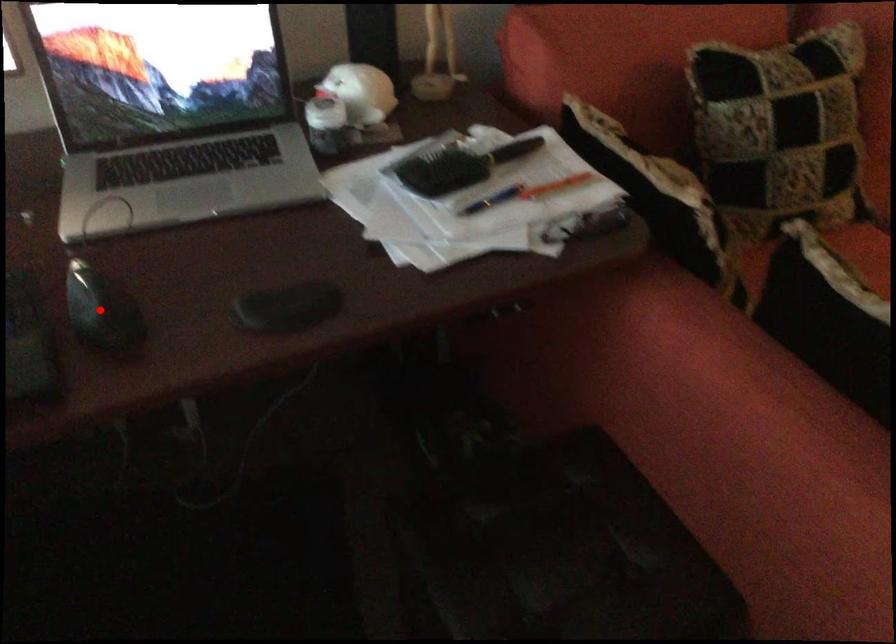
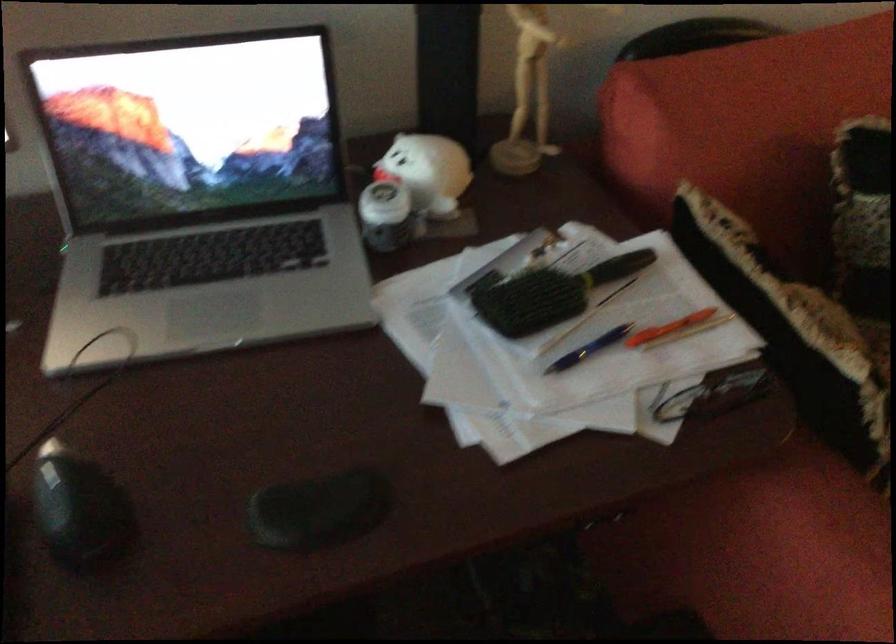
The point at the highlighted location is marked in the first image. Where is the corresponding point in the second image?

(80, 511)